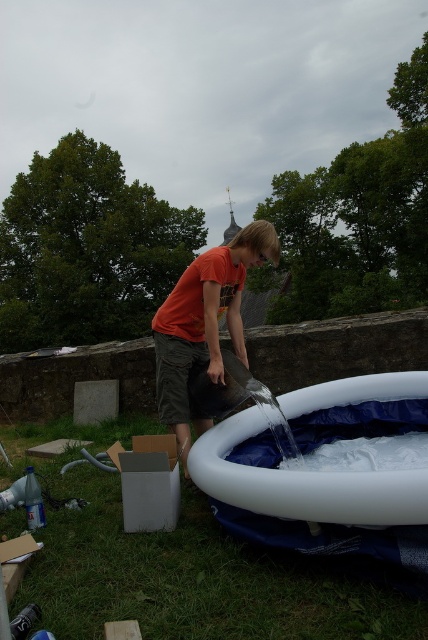
You are standing in the outdoor scene and want to fill the white inflatable tub at lower center with water. If you are holding a standard garden hose that can reach 2 meters, will you be able to reach the tub without moving closer?

The distance between you and the white inflatable tub at lower center is 1.84 meters, which is within the 2 meter reach of the garden hose. Therefore, you can reach the tub without moving closer.